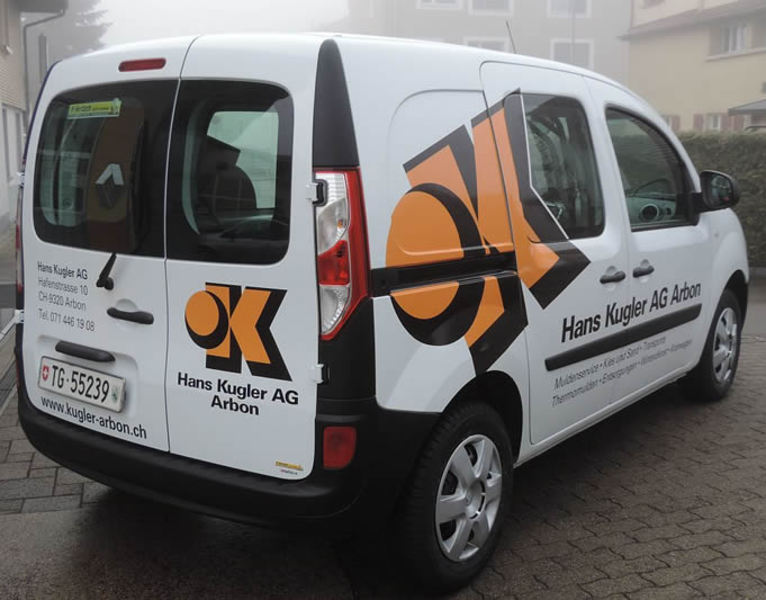
This screenshot has width=766, height=600. Identify the location of back windows. (217, 165), (106, 175).